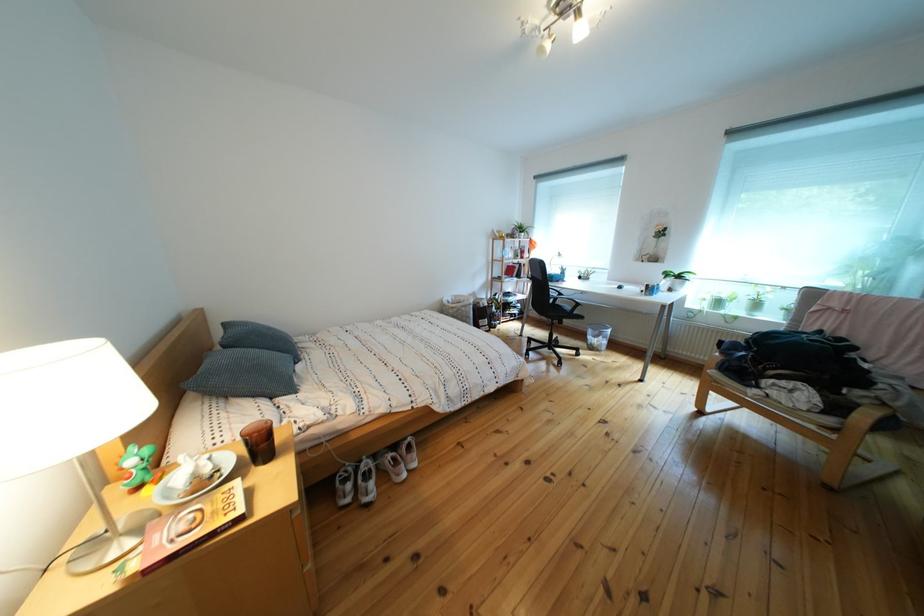
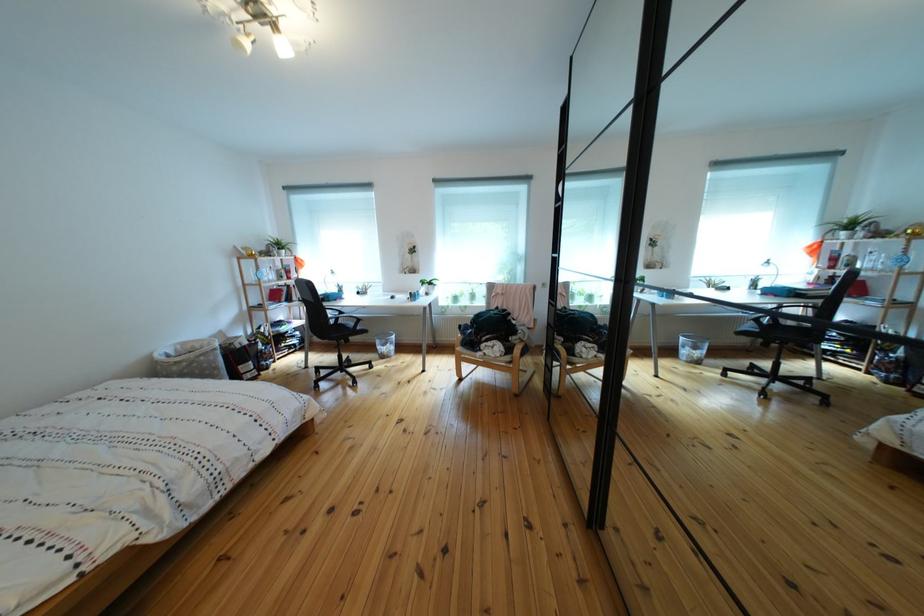
In the second image, find the point that corresponds to [520,265] in the first image.

(282, 286)